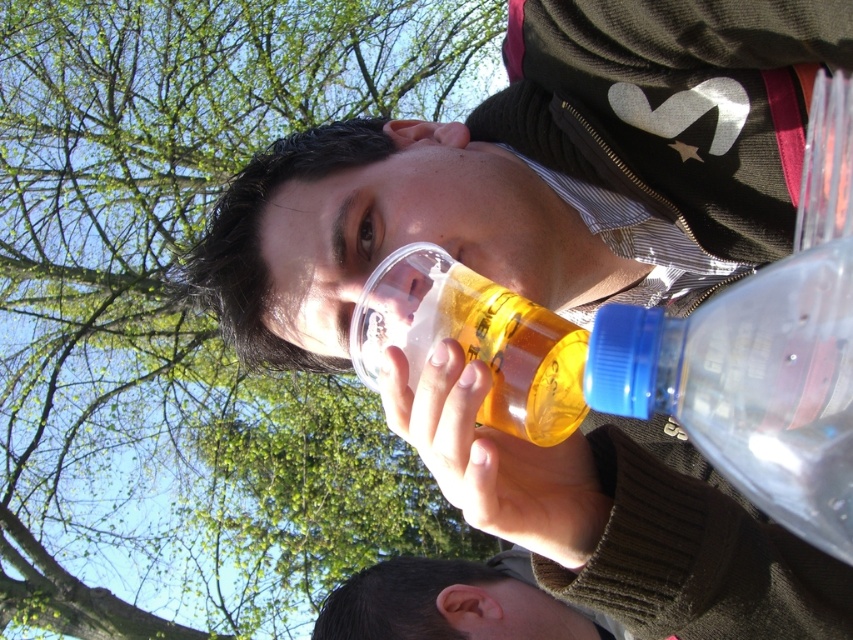
You are at a picnic and want to pour the contents of the transparent plastic bottle at right into the translucent plastic cup at upper center. Which object should you move first to do this?

You should move the transparent plastic bottle at right first because it is to the right of the translucent plastic cup at upper center, so pouring would require accessing the bottle first.

You are at a picnic and need to pour the contents of the transparent plastic bottle at right into the translucent plastic cup at upper center. Will the cup overflow?

The transparent plastic bottle at right is taller than the translucent plastic cup at upper center, but height alone doesn not determine capacity. The cup might still overflow if the bottle has a larger volume. Check the bottle and cup sizes carefully before pouring.